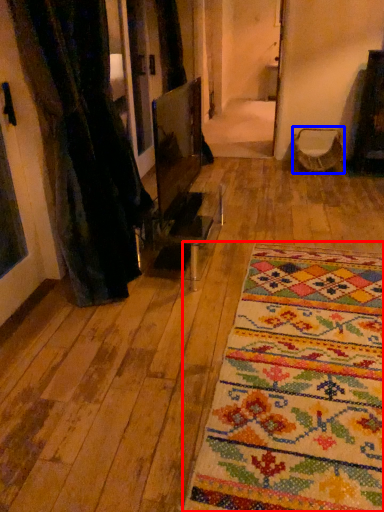
Question: Which object is further to the camera taking this photo, mat (highlighted by a red box) or armchair (highlighted by a blue box)?

Choices:
 (A) mat
 (B) armchair

Answer: (B)